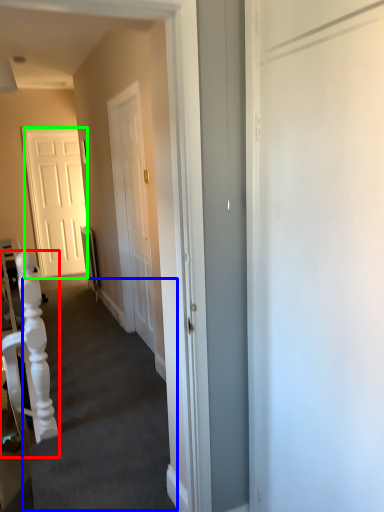
Question: Which is farther away from armchair (highlighted by a red box)? stairwell (highlighted by a blue box) or door (highlighted by a green box)?

Choices:
 (A) stairwell
 (B) door

Answer: (B)